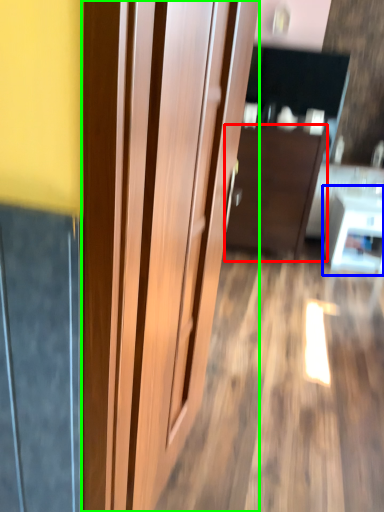
Question: Which object is positioned farthest from furniture (highlighted by a red box)? Select from table (highlighted by a blue box) and door (highlighted by a green box).

Choices:
 (A) table
 (B) door

Answer: (B)